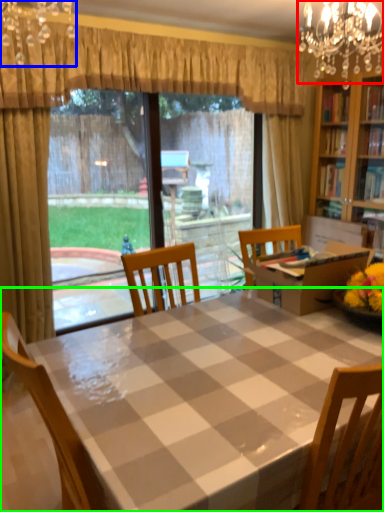
Question: Estimate the real-world distances between objects in this image. Which object is farther from light fixture (highlighted by a red box), light fixture (highlighted by a blue box) or kitchen & dining room table (highlighted by a green box)?

Choices:
 (A) light fixture
 (B) kitchen & dining room table

Answer: (B)